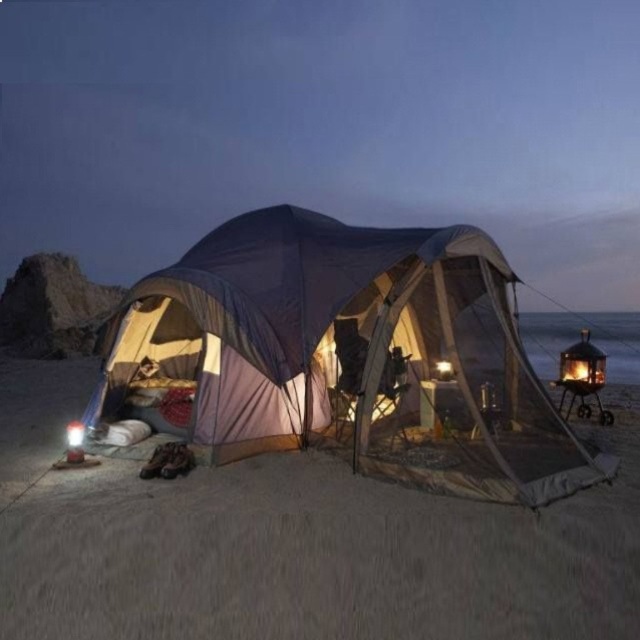
You are standing at the edge of the beach and want to place a small lantern exactly where the sandy beige sand at lower center is located. According to the coordinates provided, where should you place the lantern?

The sandy beige sand at lower center is located at coordinates point (x=292, y=545), so you should place the lantern there.

You are a camper who wants to set up a small stool between the sandy beige sand at lower center and the matte purple tent at center. Which object should you place the stool closer to in order to ensure it doesn

The sandy beige sand at lower center is shorter than the matte purple tent at center. Therefore, you should place the stool closer to the sandy beige sand at lower center to ensure stability.

You are standing outside the matte purple tent at center and want to place a small lantern on the sandy beige sand at lower center. Can you reach the sand from your current position without moving closer to it?

The sandy beige sand at lower center is further to the viewer than the matte purple tent at center, so you are already closer to the sand than the tent. Therefore, you can reach the sandy beige sand at lower center from your current position without moving closer.